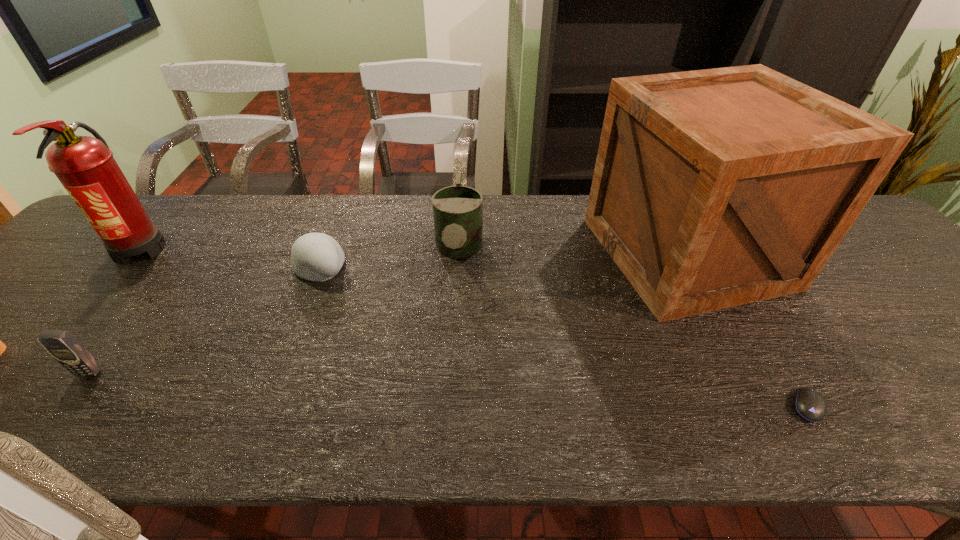
The width and height of the screenshot is (960, 540). Find the location of `box`. box is located at coordinates (714, 188).

Locate an element on the screen. The width and height of the screenshot is (960, 540). fire extinguisher is located at coordinates (85, 166).

You are a GUI agent. You are given a task and a screenshot of the screen. Output one action in this format:
    pyautogui.click(x=<x>, y=<y>)
    Task: Click on the watering can
    
    Given the screenshot: What is the action you would take?
    pyautogui.click(x=457, y=210)

Identify the location of the third tallest object. (457, 210).

This screenshot has width=960, height=540. I want to click on cellular telephone, so click(x=66, y=349).

Identify the location of the fourth tallest object. This screenshot has width=960, height=540. (66, 349).

The width and height of the screenshot is (960, 540). What are the coordinates of `the fourth object from right to left` in the screenshot? It's located at (314, 256).

The height and width of the screenshot is (540, 960). Identify the location of the fifth tallest object. (314, 256).

Where is `the shortest object`? The width and height of the screenshot is (960, 540). the shortest object is located at coordinates (809, 404).

This screenshot has width=960, height=540. I want to click on computer mouse, so click(809, 404).